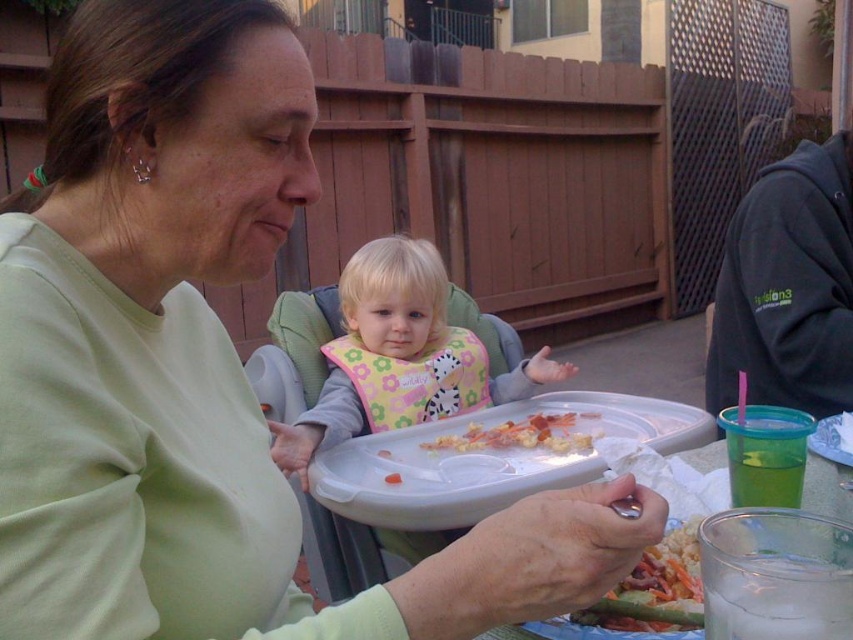
This screenshot has height=640, width=853. Describe the element at coordinates (654, 589) in the screenshot. I see `shiny plastic fork at lower center` at that location.

Which is below, shiny plastic fork at lower center or crumbly bread at center?

Positioned lower is crumbly bread at center.

Locate an element on the screen. This screenshot has height=640, width=853. shiny plastic fork at lower center is located at coordinates (654, 589).

Identify the location of shiny plastic fork at lower center. The image size is (853, 640). (654, 589).

Between white plastic tray at center and pink fabric bib at center, which one is positioned higher?

pink fabric bib at center is above.

Is point (602, 420) farther from camera compared to point (433, 308)?

No, (602, 420) is in front of (433, 308).

Does point (366, 458) come closer to viewer compared to point (474, 374)?

Yes, it is.

Locate an element on the screen. The width and height of the screenshot is (853, 640). white plastic tray at center is located at coordinates (492, 458).

Is pink fabric bib at center shorter than crumbly bread at center?

In fact, pink fabric bib at center may be taller than crumbly bread at center.

Which is in front, point (383, 326) or point (500, 448)?

Positioned in front is point (500, 448).

Is point (334, 349) in front of point (587, 445)?

No, (334, 349) is behind (587, 445).

You are a GUI agent. You are given a task and a screenshot of the screen. Output one action in this format:
    pyautogui.click(x=<x>, y=<y>)
    Task: Click on the pink fabric bib at center
    
    Given the screenshot: What is the action you would take?
    pyautogui.click(x=399, y=356)